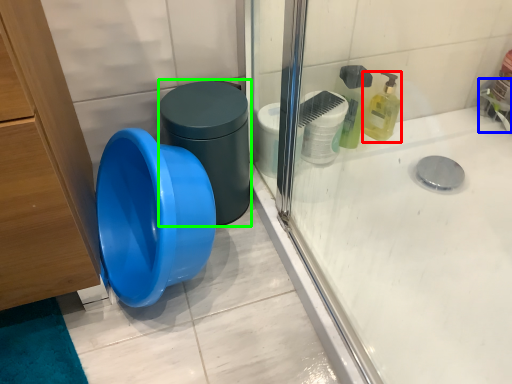
Question: Estimate the real-world distances between objects in this image. Which object is farther from cleaning product (highlighted by a red box), faucet (highlighted by a blue box) or potty (highlighted by a green box)?

Choices:
 (A) faucet
 (B) potty

Answer: (B)